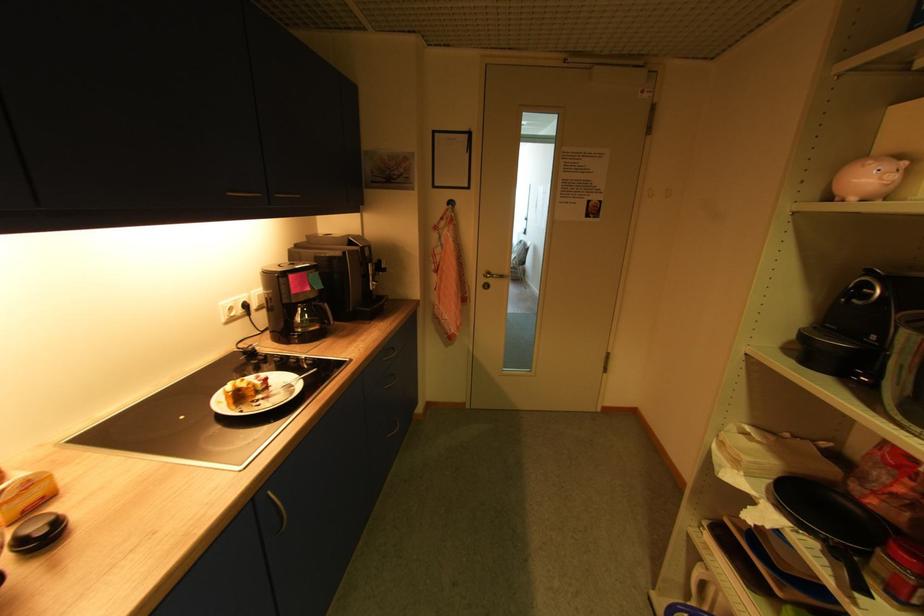
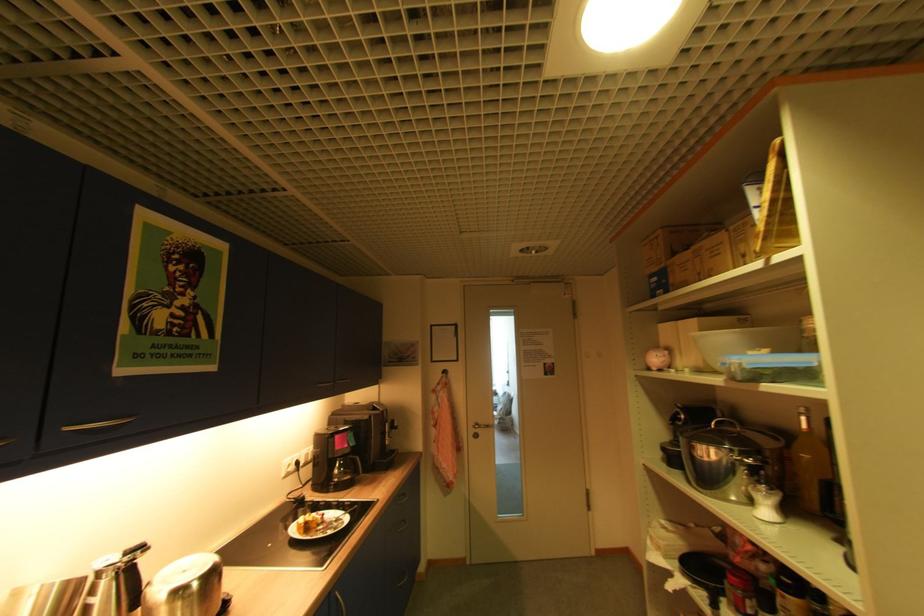
Find the pixel in the second image that matches the point at 297,277 in the first image.

(343, 437)